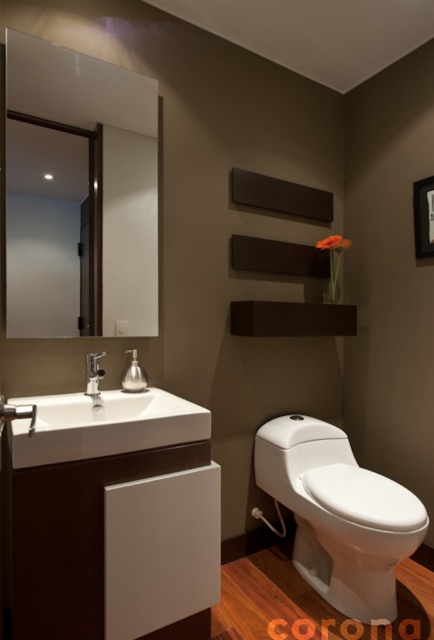
Question: Which object is positioned closest to the clear glass mirror at upper left?

Choices:
 (A) white glossy toilet at lower right
 (B) black matte picture frame at upper right

Answer: (A)

Question: Does white glossy sink at lower left appear on the right side of silver metallic faucet at sink left?

Choices:
 (A) yes
 (B) no

Answer: (A)

Question: In this image, where is white glossy toilet at lower right located relative to black matte picture frame at upper right?

Choices:
 (A) below
 (B) above

Answer: (A)

Question: Among these objects, which one is nearest to the camera?

Choices:
 (A) black matte picture frame at upper right
 (B) silver metallic faucet at sink left

Answer: (B)

Question: Which object appears farthest from the camera in this image?

Choices:
 (A) silver metallic faucet at sink left
 (B) black matte picture frame at upper right
 (C) white glossy toilet at lower right

Answer: (B)

Question: Does clear glass mirror at upper left have a lesser width compared to silver metallic faucet at sink left?

Choices:
 (A) no
 (B) yes

Answer: (A)